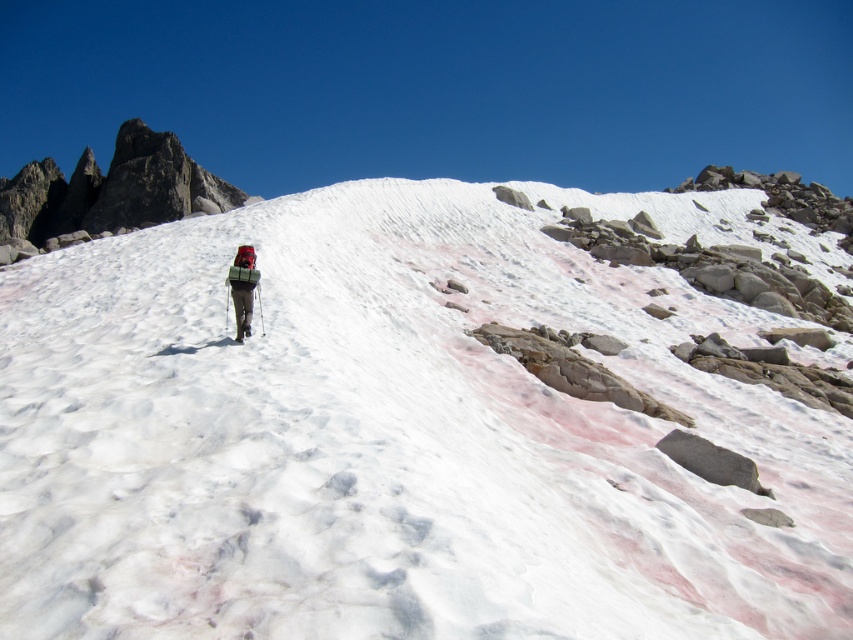
Which of these two, white powdery snow at center or green fabric backpack at center, stands shorter?

green fabric backpack at center

Which is above, white powdery snow at center or green fabric backpack at center?

Positioned higher is white powdery snow at center.

Who is more distant from viewer, (473, 380) or (247, 257)?

The point (473, 380) is more distant.

Locate an element on the screen. Image resolution: width=853 pixels, height=640 pixels. white powdery snow at center is located at coordinates (395, 435).